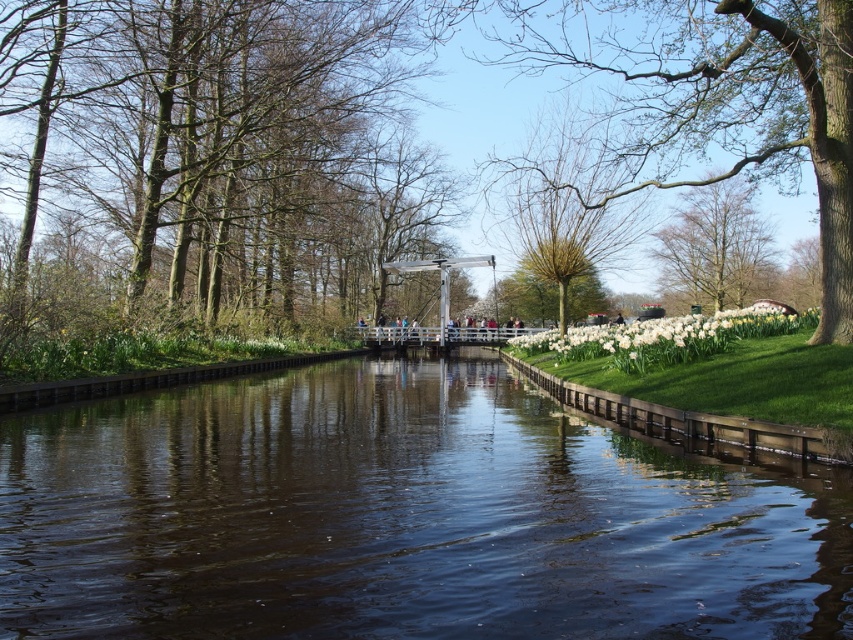
You are a painter standing at the center of the canal. You want to paint both the brown bark tree at left and the white glossy daffodil at right. Which object should you focus on first if you want to paint the larger one first?

The brown bark tree at left is larger than the white glossy daffodil at right, so you should focus on painting the brown bark tree at left first.